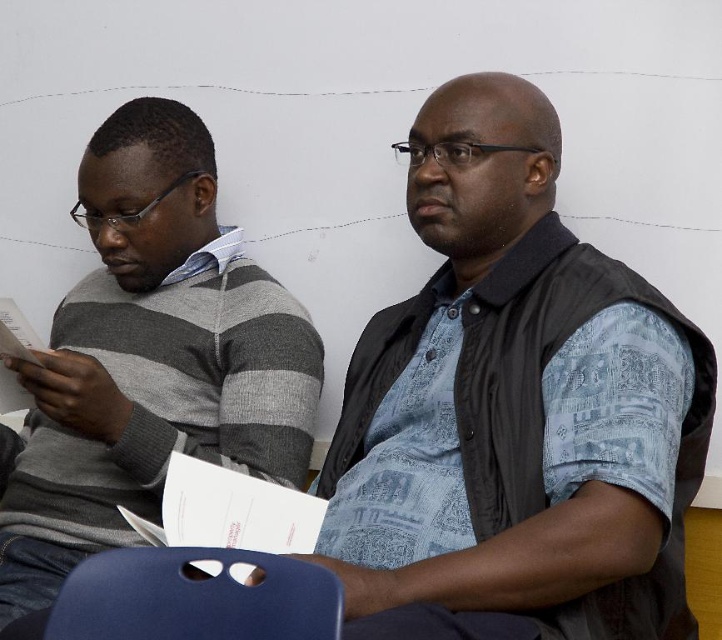
Between blue printed shirt at center and matte blue chair at lower center, which one has more height?

blue printed shirt at center

Describe the element at coordinates (505, 400) in the screenshot. I see `blue printed shirt at center` at that location.

Is point (613, 595) farther from viewer compared to point (269, 588)?

That is True.

The width and height of the screenshot is (722, 640). I want to click on blue printed shirt at center, so click(505, 400).

Which is more to the left, blue printed shirt at center or gray striped sweater at left?

gray striped sweater at left

Does point (549, 193) come farther from viewer compared to point (47, 536)?

No, it is in front of (47, 536).

Where is `blue printed shirt at center`? blue printed shirt at center is located at coordinates (505, 400).

Which is more to the right, gray striped sweater at left or matte blue chair at lower center?

Positioned to the right is matte blue chair at lower center.

Is the position of gray striped sweater at left more distant than that of matte blue chair at lower center?

Yes.

Which is behind, point (69, 456) or point (175, 570)?

The point (69, 456) is more distant.

The height and width of the screenshot is (640, 722). I want to click on gray striped sweater at left, so click(x=149, y=356).